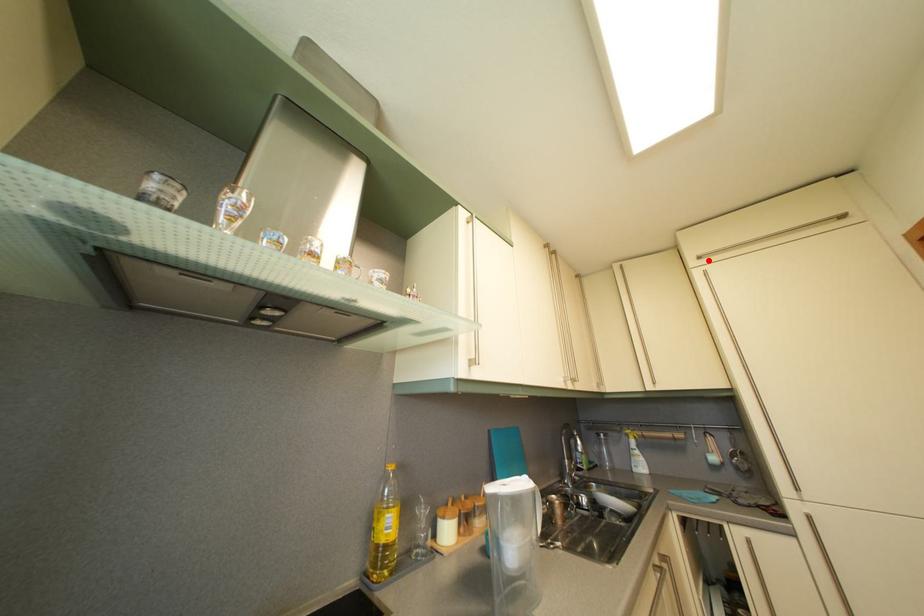
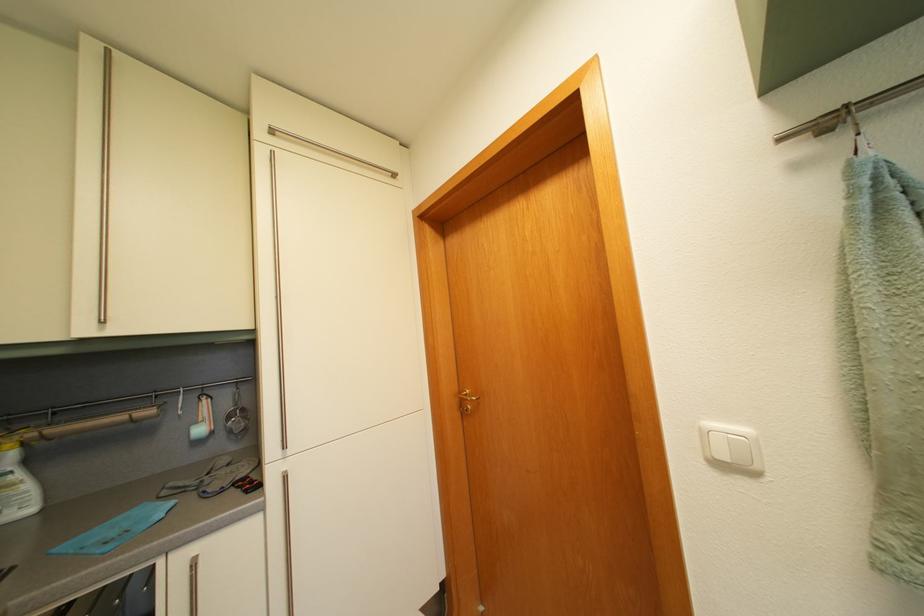
Locate, in the second image, the point that corresponds to the highlighted location in the first image.

(284, 132)